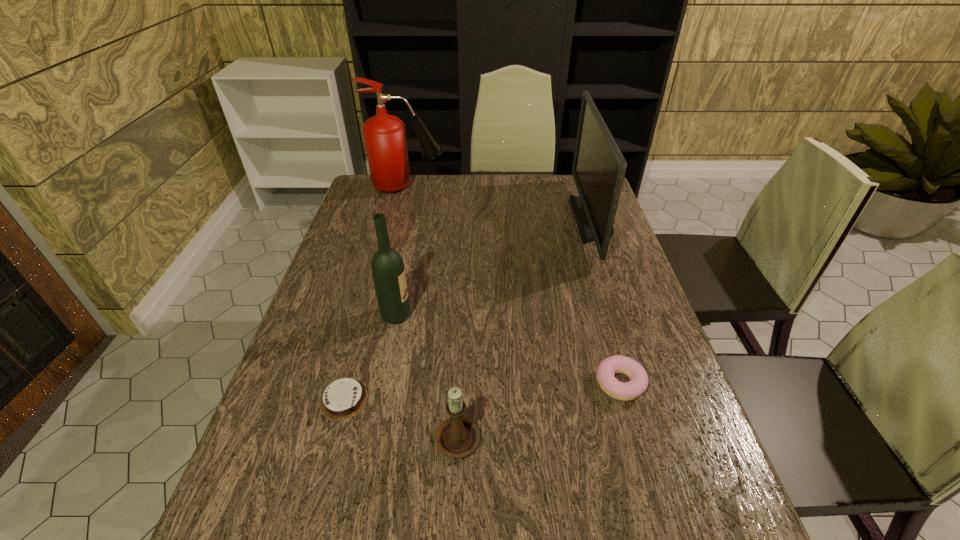
Where is `chocolate cake that is at the left edge`? The image size is (960, 540). chocolate cake that is at the left edge is located at coordinates (344, 398).

Identify the location of monitor located at the right edge. (598, 169).

Find the location of `doughnut that is at the right edge`. doughnut that is at the right edge is located at coordinates (606, 370).

Identify the location of object that is at the far left corner. (385, 139).

You are a GUI agent. You are given a task and a screenshot of the screen. Output one action in this format:
    pyautogui.click(x=<x>, y=<y>)
    Task: Click on the object positioned at the far right corner
    This screenshot has height=540, width=960.
    Given the screenshot: What is the action you would take?
    pyautogui.click(x=598, y=169)

In the image, there is a desktop. Find the location of `vacant space at the far edge`. vacant space at the far edge is located at coordinates coord(450,199).

Image resolution: width=960 pixels, height=540 pixels. I want to click on free region at the left edge, so click(x=281, y=476).

In the image, there is a desktop. Where is `blank space at the right edge`? blank space at the right edge is located at coordinates (612, 355).

The image size is (960, 540). In order to click on free space that is in between the fire extinguisher and the monitor in this screenshot , I will do `click(499, 203)`.

Find the location of a particular element. The image size is (960, 540). free spot between the monitor and the fire extinguisher is located at coordinates [499, 203].